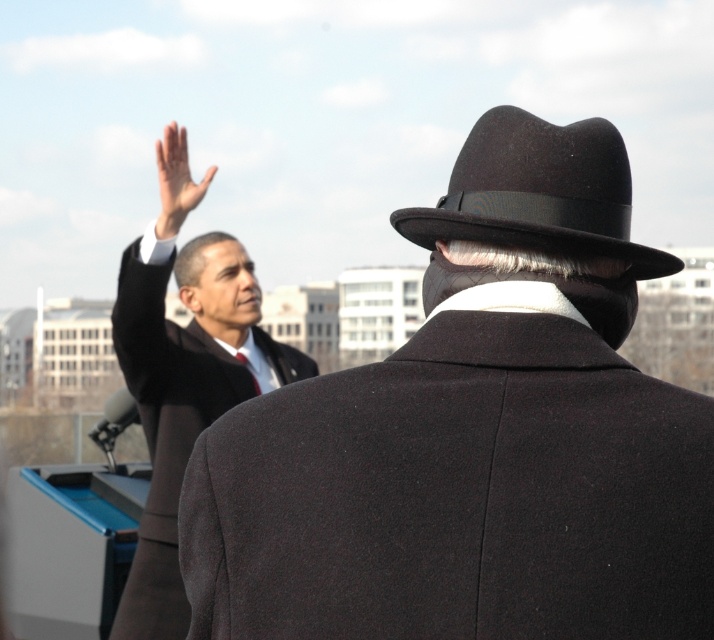
You are standing at the point with coordinates point (x=164, y=131) and want to move towards the point with coordinates point (x=129, y=260). Which direction should you move in relation to your current position?

You should move towards the point (x=129, y=260), which is closer to the camera than the point (x=164, y=131). Since point (x=129, y=260) is closer, you would need to move forward in the direction towards the camera to reach it from your current position.

You are standing at the camera position and want to know what is located at the coordinates point (473,436). According to the scene description, what object is at that point?

The object at point (473,436) is the matte black coat at center.

You are standing at the position of the viewer and want to hand a document to the person wearing the black felt fedora at upper right. If you walk straight towards them, will you be able to reach them without moving sideways?

The black felt fedora at upper right and viewer are 3.15 meters apart. Since you are walking straight towards them, you can reach them without needing to move sideways as the distance is directly ahead.